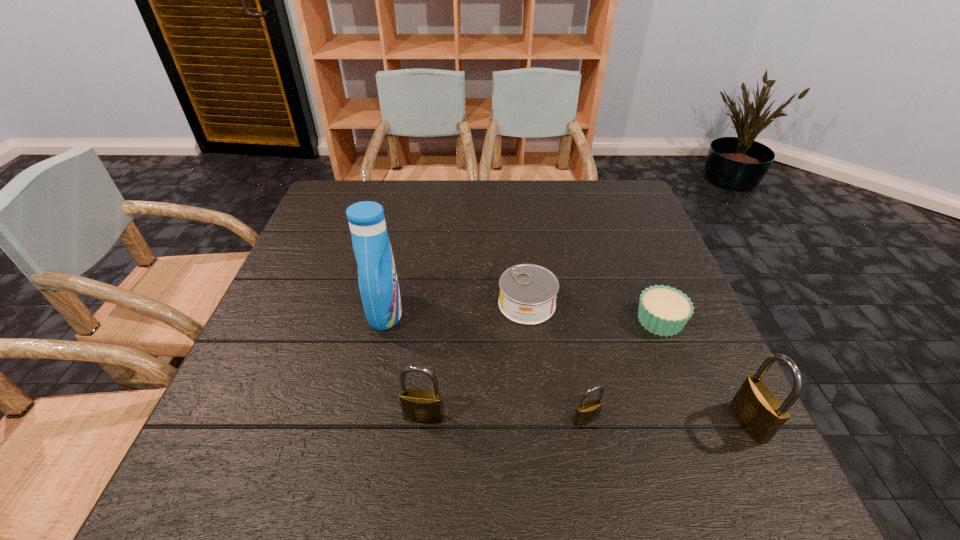
Find the location of a particular element. vacant point that satisfies the following two spatial constraints: 1. on the front-facing side of the second padlock from right to left; 2. on the left side of the tallest object is located at coordinates (362, 420).

The height and width of the screenshot is (540, 960). Identify the location of free spot that satisfies the following two spatial constraints: 1. on the front side of the fifth object from left to right; 2. on the right side of the rightmost padlock. (702, 422).